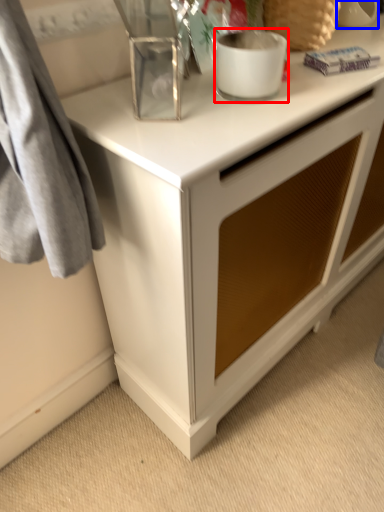
Question: Which point is closer to the camera, appliance (highlighted by a red box) or appliance (highlighted by a blue box)?

Choices:
 (A) appliance
 (B) appliance

Answer: (A)